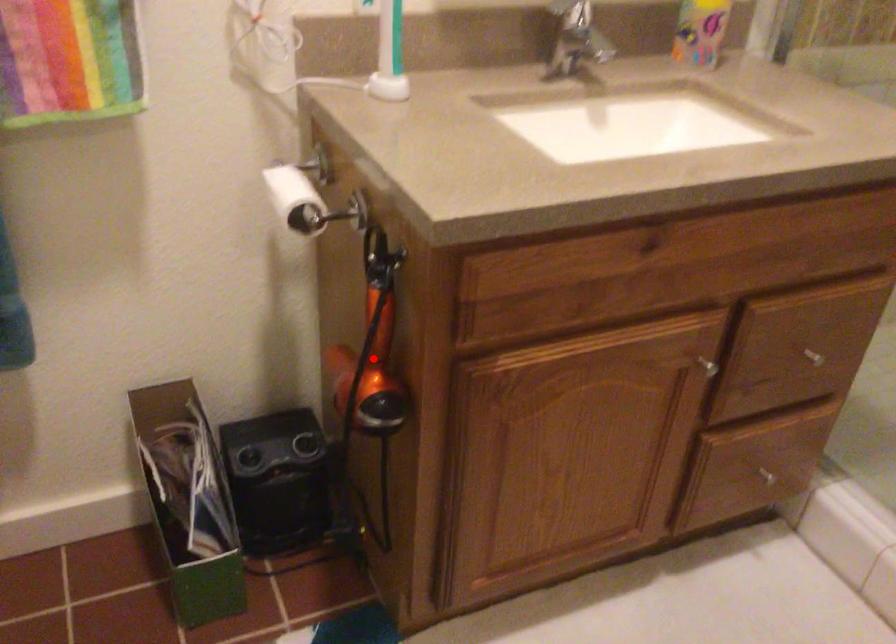
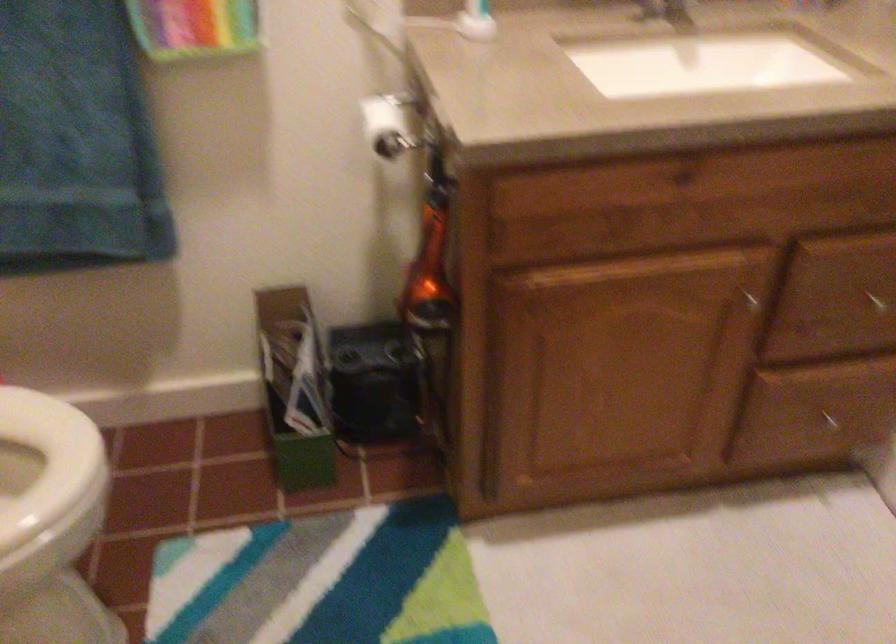
The point at the highlighted location is marked in the first image. Where is the corresponding point in the second image?

(429, 267)